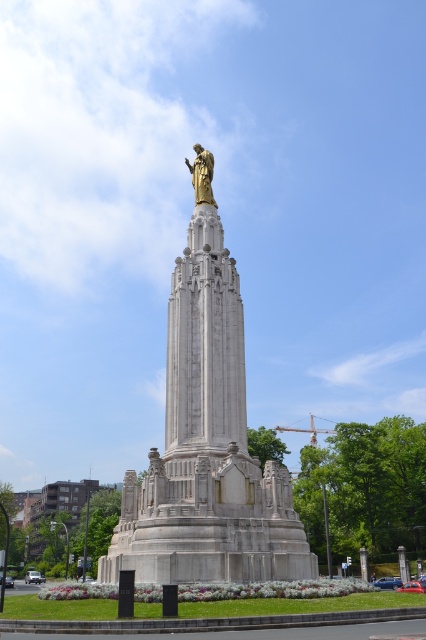
You are standing in the public square where the monument is located. You see a point marked at coordinates (207, 448). What does this point indicate?

The point at coordinates (207, 448) marks the location of the polished bronze statue at center.

You are standing at the center of the public square and want to take a photo of the polished bronze statue at center. Which direction should you face to ensure the statue is in the frame?

You should face north to capture the polished bronze statue at center in your photo since it is located at point [207,448].

You are standing in the public square looking at the monument. You notice two statues on the monument. The first is a polished bronze statue at center and the second is a gold polished statue at upper center. Which statue is closer to you?

The polished bronze statue at center is closer to you because it is 65.87 feet away from the gold polished statue at upper center, meaning the bronze statue is positioned lower on the monument and thus nearer to your viewpoint.